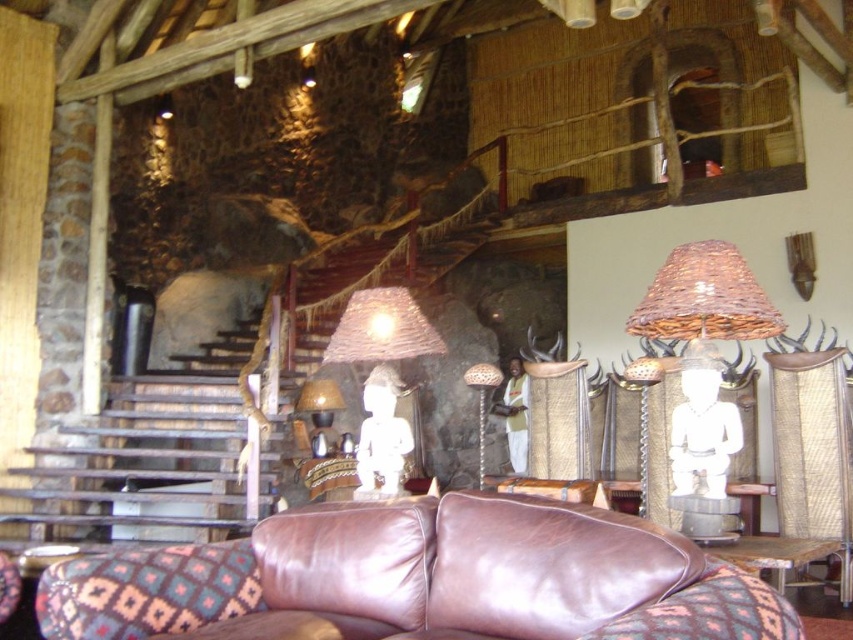
You are standing in the room and want to place a small statue on the table directly in front of you. The table is positioned between the brown leather sofa and the woven straw lampshade at center. Which direction should you move to reach the table?

To reach the table between the brown leather sofa and the woven straw lampshade at center, you should move forward towards the center of the room since the table is positioned between them.

You are a guest in this room and want to place a small decorative item on the brown leather couch at lower center and the woven straw lampshade at center. Based on their heights, which one can you place the item on without it being too low or too high?

The brown leather couch at lower center is much taller than the woven straw lampshade at center, so placing the item on the woven straw lampshade at center would be more appropriate to avoid it being too high.

You are an interior designer planning to place a rectangular decorative item between the woven straw lampshade at center and the matte wicker lampshade at center. The item is 12 inches wide. Can you confirm if there is enough space between them to accommodate it?

The woven straw lampshade at center is wider than the matte wicker lampshade at center. However, the exact distance between them isn t specified, so we can t determine if the 12 inch item will fit without additional information about their spacing.